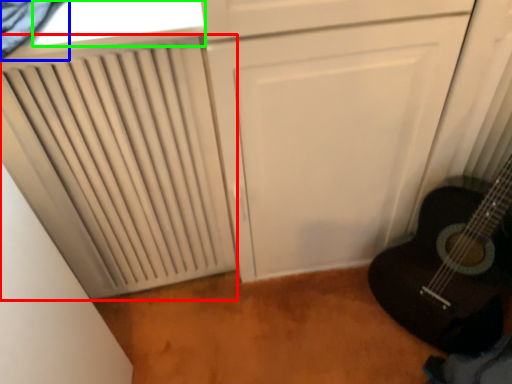
Question: Which object is the closest to the radiator (highlighted by a red box)? Choose among these: curtain (highlighted by a blue box) or window (highlighted by a green box).

Choices:
 (A) curtain
 (B) window

Answer: (B)